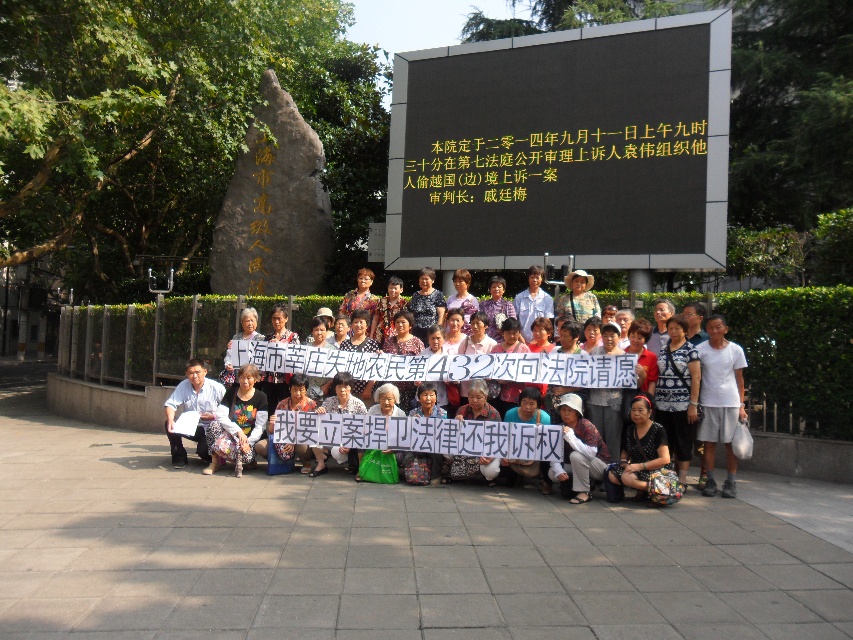
Measure the distance between white cotton shirt at center and yellow text at upper center.

white cotton shirt at center and yellow text at upper center are 3.99 meters apart.

Which is more to the left, white cotton shirt at center or yellow text at upper center?

white cotton shirt at center is more to the left.

Does point (648, 369) come behind point (440, 193)?

No.

The height and width of the screenshot is (640, 853). Identify the location of white cotton shirt at center. (445, 365).

Which of these two, black matte sign at upper center or white cotton shirt at center, stands taller?

black matte sign at upper center is taller.

Between black matte sign at upper center and white cotton shirt at center, which one is positioned higher?

Positioned higher is black matte sign at upper center.

Locate an element on the screen. The width and height of the screenshot is (853, 640). black matte sign at upper center is located at coordinates (563, 148).

Who is higher up, black matte sign at upper center or yellow text at upper center?

black matte sign at upper center is above.

Does black matte sign at upper center have a lesser height compared to yellow text at upper center?

No, black matte sign at upper center is not shorter than yellow text at upper center.

Between point (437, 211) and point (526, 136), which one is positioned in front?

Positioned in front is point (526, 136).

At what (x,y) coordinates should I click in order to perform the action: click on black matte sign at upper center. Please return your answer as a coordinate pair (x, y). Looking at the image, I should click on (563, 148).